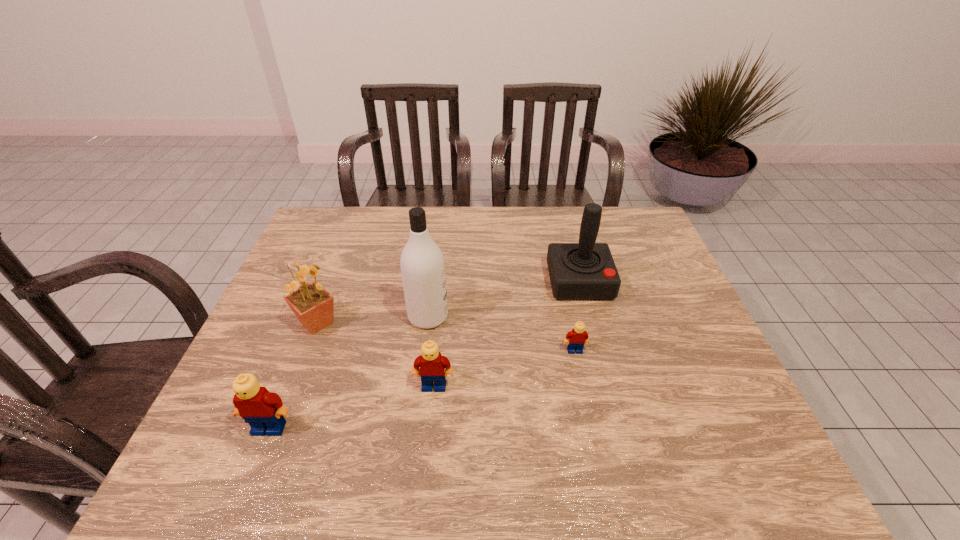
Please point a spot on the right to add another Lego. Please provide its 2D coordinates. Your answer should be formatted as a tuple, i.e. [(x, y)], where the tuple contains the x and y coordinates of a point satisfying the conditions above.

[(697, 320)]